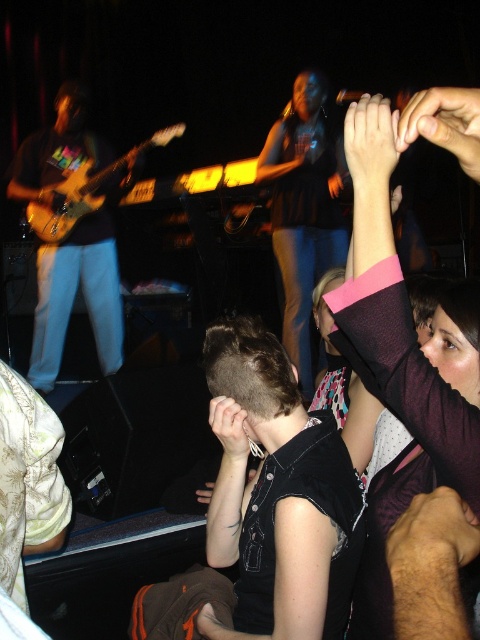
Consider the image. You are a photographer at the live music performance. You want to capture a photo where the matte black guitar at left and the matte black hand at center are both in focus. Based on their positions, which object is closer to the left edge of the photo frame?

The matte black guitar at left is positioned on the left side of the matte black hand at center, so the matte black guitar at left is closer to the left edge of the photo frame.

You are standing at the front of the stage and want to move to the back. Which point should you walk towards first, point (67, 164) or point (78, 216)?

You should walk towards point (67, 164) first because it is behind point (78, 216).

You are a photographer at the back of the venue trying to take a clear picture of the denim jeans at center and the wooden electric guitar at left. Which object is blocking your view of the other?

The wooden electric guitar at left is blocking the view of the denim jeans at center because the denim jeans at center is positioned under the wooden electric guitar at left.